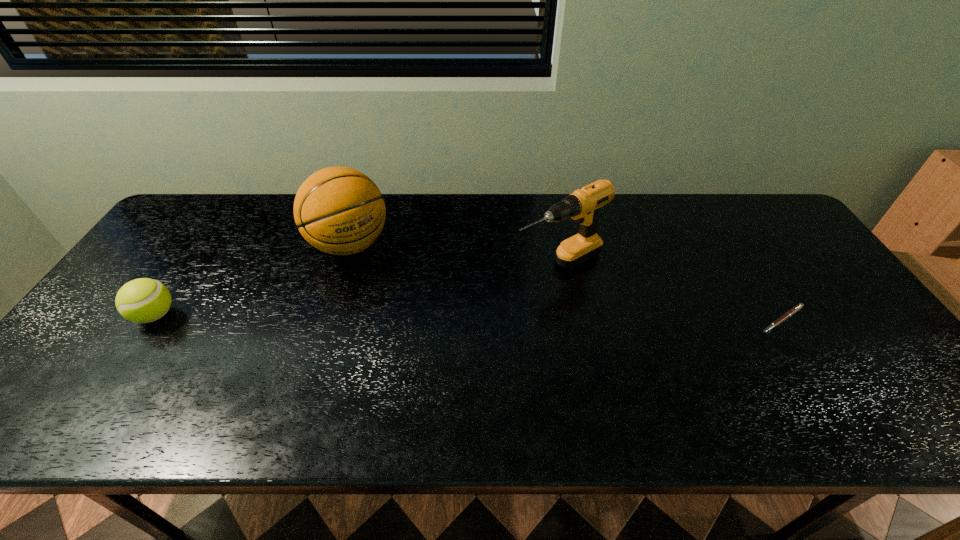
Identify the location of vacant space at the right edge of the desktop. (846, 326).

At what (x,y) coordinates should I click in order to perform the action: click on vacant space in between the third object from right to left and the second shortest object. Please return your answer as a coordinate pair (x, y). Looking at the image, I should click on (252, 280).

I want to click on free space between the second object from right to left and the rightmost object, so click(670, 293).

Identify the location of free spot between the third object from left to right and the basketball. (454, 255).

Find the location of a particular element. This screenshot has height=540, width=960. free space between the second object from right to left and the third object from right to left is located at coordinates (454, 255).

Identify the location of empty location between the rightmost object and the tennis ball. (468, 318).

The image size is (960, 540). What are the coordinates of `free spot between the third object from right to left and the tennis ball` in the screenshot? It's located at [x=252, y=280].

Image resolution: width=960 pixels, height=540 pixels. I want to click on free point between the second object from left to right and the pen, so click(x=565, y=282).

The width and height of the screenshot is (960, 540). What are the coordinates of `empty space that is in between the second object from left to right and the third tallest object` in the screenshot? It's located at (252, 280).

I want to click on free point between the shortest object and the leftmost object, so click(x=468, y=318).